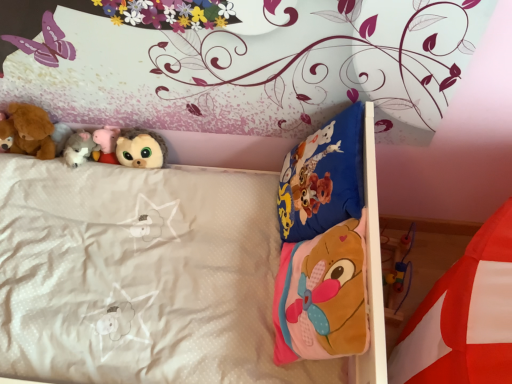
Question: Can you confirm if fluffy brown plush at upper center, positioned as the first toy in right-to-left order, is taller than white plush toy at upper left, the third toy when ordered from right to left?

Choices:
 (A) no
 (B) yes

Answer: (B)

Question: Can you confirm if fluffy brown plush at upper center, positioned as the first toy in right-to-left order, is thinner than white plush toy at upper left, the third toy when ordered from right to left?

Choices:
 (A) yes
 (B) no

Answer: (A)

Question: From the image's perspective, does fluffy brown plush at upper center, arranged as the 5th toy when viewed from the left, appear lower than white plush toy at upper left, arranged as the third toy when viewed from the left?

Choices:
 (A) yes
 (B) no

Answer: (A)

Question: Does fluffy brown plush at upper center, arranged as the 5th toy when viewed from the left, appear on the right side of white plush toy at upper left, the third toy when ordered from right to left?

Choices:
 (A) no
 (B) yes

Answer: (B)

Question: Is fluffy brown plush at upper center, positioned as the first toy in right-to-left order, looking in the opposite direction of white plush toy at upper left, the third toy when ordered from right to left?

Choices:
 (A) no
 (B) yes

Answer: (A)

Question: Considering the relative sizes of fluffy brown plush at upper center, arranged as the 5th toy when viewed from the left, and white plush toy at upper left, the third toy when ordered from right to left, in the image provided, is fluffy brown plush at upper center, arranged as the 5th toy when viewed from the left, bigger than white plush toy at upper left, the third toy when ordered from right to left,?

Choices:
 (A) yes
 (B) no

Answer: (A)

Question: From a real-world perspective, does pink plush pig at upper left, the second toy in the right-to-left sequence, stand above brown plush bear at left, which is the first toy from left to right?

Choices:
 (A) yes
 (B) no

Answer: (B)

Question: From a real-world perspective, is pink plush pig at upper left, which ranks as the 4th toy in left-to-right order, positioned under brown plush bear at left, which is the fifth toy in right-to-left order, based on gravity?

Choices:
 (A) yes
 (B) no

Answer: (A)

Question: Is pink plush pig at upper left, which ranks as the 4th toy in left-to-right order, smaller than brown plush bear at left, which is the fifth toy in right-to-left order?

Choices:
 (A) no
 (B) yes

Answer: (B)

Question: Could you tell me if pink plush pig at upper left, the second toy in the right-to-left sequence, is facing brown plush bear at left, which is the first toy from left to right?

Choices:
 (A) no
 (B) yes

Answer: (A)

Question: Is pink plush pig at upper left, which ranks as the 4th toy in left-to-right order, to the left of brown plush bear at left, which is the fifth toy in right-to-left order, from the viewer's perspective?

Choices:
 (A) no
 (B) yes

Answer: (A)

Question: Considering the relative sizes of pink plush pig at upper left, which ranks as the 4th toy in left-to-right order, and brown plush bear at left, which is the fifth toy in right-to-left order, in the image provided, is pink plush pig at upper left, which ranks as the 4th toy in left-to-right order, bigger than brown plush bear at left, which is the fifth toy in right-to-left order,?

Choices:
 (A) yes
 (B) no

Answer: (B)

Question: Is white plush toy at upper left, arranged as the third toy when viewed from the left, looking in the opposite direction of soft pink fabric mattress at lower right?

Choices:
 (A) yes
 (B) no

Answer: (B)